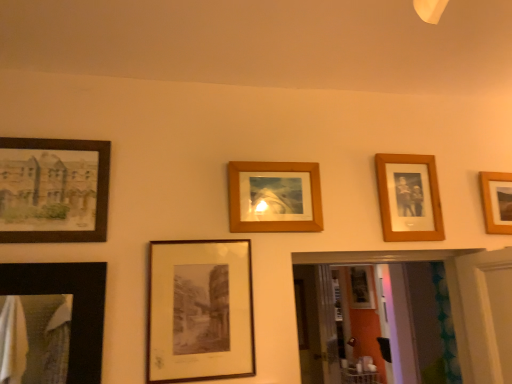
Question: From a real-world perspective, is wooden photo frame at upper right, the 2th picture frame from the right, positioned under wooden frame at center, which is the 3th picture frame from left to right, based on gravity?

Choices:
 (A) no
 (B) yes

Answer: (A)

Question: Is wooden photo frame at upper right, the fourth picture frame positioned from the left, further to camera compared to wooden frame at center, which is the 3th picture frame from left to right?

Choices:
 (A) no
 (B) yes

Answer: (B)

Question: Are wooden photo frame at upper right, the 2th picture frame from the right, and wooden frame at center, which appears as the third picture frame when viewed from the right, located far from each other?

Choices:
 (A) yes
 (B) no

Answer: (B)

Question: Is wooden photo frame at upper right, the 2th picture frame from the right, facing away from wooden frame at center, which appears as the third picture frame when viewed from the right?

Choices:
 (A) no
 (B) yes

Answer: (A)

Question: Considering the relative sizes of wooden photo frame at upper right, the 2th picture frame from the right, and wooden frame at center, which appears as the third picture frame when viewed from the right, in the image provided, is wooden photo frame at upper right, the 2th picture frame from the right, wider than wooden frame at center, which appears as the third picture frame when viewed from the right,?

Choices:
 (A) no
 (B) yes

Answer: (B)

Question: Is wooden photo frame at upper right, the 2th picture frame from the right, taller or shorter than matte black frame at center, acting as the 2th picture frame starting from the left?

Choices:
 (A) tall
 (B) short

Answer: (B)

Question: Visually, is wooden photo frame at upper right, the 2th picture frame from the right, positioned to the left or to the right of matte black frame at center, marked as the 4th picture frame in a right-to-left arrangement?

Choices:
 (A) left
 (B) right

Answer: (B)

Question: Is wooden photo frame at upper right, the fourth picture frame positioned from the left, inside the boundaries of matte black frame at center, marked as the 4th picture frame in a right-to-left arrangement, or outside?

Choices:
 (A) inside
 (B) outside

Answer: (B)

Question: Looking at their shapes, would you say wooden photo frame at upper right, the 2th picture frame from the right, is wider or thinner than matte black frame at center, acting as the 2th picture frame starting from the left?

Choices:
 (A) wide
 (B) thin

Answer: (A)

Question: From the image's perspective, relative to wooden frame at center, which is the 3th picture frame from left to right, is matte black painting at left, the first picture frame viewed from the left, above or below?

Choices:
 (A) above
 (B) below

Answer: (A)

Question: Is matte black painting at left, placed as the fifth picture frame when sorted from right to left, wider or thinner than wooden frame at center, which is the 3th picture frame from left to right?

Choices:
 (A) thin
 (B) wide

Answer: (B)

Question: Considering the relative positions of matte black painting at left, placed as the fifth picture frame when sorted from right to left, and wooden frame at center, which is the 3th picture frame from left to right, in the image provided, is matte black painting at left, placed as the fifth picture frame when sorted from right to left, to the left or to the right of wooden frame at center, which is the 3th picture frame from left to right,?

Choices:
 (A) right
 (B) left

Answer: (B)

Question: Considering the positions of point (40, 233) and point (301, 218), is point (40, 233) closer or farther from the camera than point (301, 218)?

Choices:
 (A) closer
 (B) farther

Answer: (A)

Question: From a real-world perspective, is wooden photo frame at upper right, the 2th picture frame from the right, physically located above or below wooden frame at upper right, acting as the first picture frame starting from the right?

Choices:
 (A) below
 (B) above

Answer: (B)

Question: Choose the correct answer: Is wooden photo frame at upper right, the 2th picture frame from the right, inside wooden frame at upper right, the 5th picture frame positioned from the left, or outside it?

Choices:
 (A) outside
 (B) inside

Answer: (A)